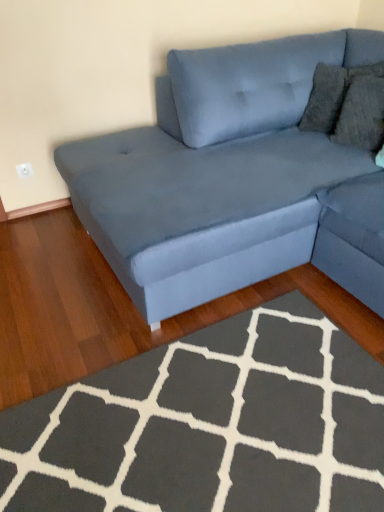
Where is `velvet blue couch at upper right`? The width and height of the screenshot is (384, 512). velvet blue couch at upper right is located at coordinates (231, 179).

What do you see at coordinates (231, 179) in the screenshot? I see `velvet blue couch at upper right` at bounding box center [231, 179].

This screenshot has height=512, width=384. What do you see at coordinates (210, 425) in the screenshot?
I see `dark gray plush rug at lower center` at bounding box center [210, 425].

Measure the distance between dark gray plush rug at lower center and camera.

A distance of 1.14 meters exists between dark gray plush rug at lower center and camera.

At what (x,y) coordinates should I click in order to perform the action: click on dark gray plush rug at lower center. Please return your answer as a coordinate pair (x, y). Image resolution: width=384 pixels, height=512 pixels. Looking at the image, I should click on (210, 425).

Locate an element on the screen. This screenshot has width=384, height=512. velvet blue couch at upper right is located at coordinates (231, 179).

Which is more to the left, velvet blue couch at upper right or dark gray plush rug at lower center?

dark gray plush rug at lower center.

Is velvet blue couch at upper right behind dark gray plush rug at lower center?

Yes, it is behind dark gray plush rug at lower center.

Does point (83, 197) appear closer or farther from the camera than point (103, 407)?

Point (83, 197) appears to be farther away from the viewer than point (103, 407).

From the image's perspective, which is below, velvet blue couch at upper right or dark gray plush rug at lower center?

dark gray plush rug at lower center, from the image's perspective.

From a real-world perspective, who is located higher, velvet blue couch at upper right or dark gray plush rug at lower center?

velvet blue couch at upper right, from a real-world perspective.

Looking at their sizes, would you say velvet blue couch at upper right is wider or thinner than dark gray plush rug at lower center?

Considering their sizes, velvet blue couch at upper right looks broader than dark gray plush rug at lower center.

Between velvet blue couch at upper right and dark gray plush rug at lower center, which one has less height?

Standing shorter between the two is dark gray plush rug at lower center.

Between velvet blue couch at upper right and dark gray plush rug at lower center, which one has smaller size?

Smaller between the two is dark gray plush rug at lower center.

Looking at this image, is velvet blue couch at upper right not within dark gray plush rug at lower center?

Yes, velvet blue couch at upper right is not within dark gray plush rug at lower center.

Is velvet blue couch at upper right in contact with dark gray plush rug at lower center?

No.

Is velvet blue couch at upper right turned away from dark gray plush rug at lower center?

velvet blue couch at upper right is not turned away from dark gray plush rug at lower center.

This screenshot has width=384, height=512. I want to click on doormat located on the left of velvet blue couch at upper right, so click(x=210, y=425).

Is dark gray plush rug at lower center to the right of velvet blue couch at upper right from the viewer's perspective?

No.

Which object is further away from the camera, dark gray plush rug at lower center or velvet blue couch at upper right?

velvet blue couch at upper right is more distant.

Does point (249, 452) come closer to viewer compared to point (147, 202)?

Yes, point (249, 452) is in front of point (147, 202).

From the image's perspective, which one is positioned higher, dark gray plush rug at lower center or velvet blue couch at upper right?

velvet blue couch at upper right appears higher in the image.

From a real-world perspective, is dark gray plush rug at lower center physically below velvet blue couch at upper right?

Indeed, from a real-world perspective, dark gray plush rug at lower center is positioned beneath velvet blue couch at upper right.

Is dark gray plush rug at lower center thinner than velvet blue couch at upper right?

Yes, dark gray plush rug at lower center is thinner than velvet blue couch at upper right.

Considering the relative sizes of dark gray plush rug at lower center and velvet blue couch at upper right in the image provided, is dark gray plush rug at lower center shorter than velvet blue couch at upper right?

Indeed, dark gray plush rug at lower center has a lesser height compared to velvet blue couch at upper right.

Can you confirm if dark gray plush rug at lower center is bigger than velvet blue couch at upper right?

Incorrect, dark gray plush rug at lower center is not larger than velvet blue couch at upper right.

Is dark gray plush rug at lower center inside or outside of velvet blue couch at upper right?

dark gray plush rug at lower center exists outside the volume of velvet blue couch at upper right.

Would you say dark gray plush rug at lower center is a long distance from velvet blue couch at upper right?

No, dark gray plush rug at lower center is in close proximity to velvet blue couch at upper right.

Is dark gray plush rug at lower center looking in the opposite direction of velvet blue couch at upper right?

No, dark gray plush rug at lower center is not facing away from velvet blue couch at upper right.

How different are the orientations of dark gray plush rug at lower center and velvet blue couch at upper right in degrees?

91.9 degrees separate the facing orientations of dark gray plush rug at lower center and velvet blue couch at upper right.

In the image, there is a dark gray plush rug at lower center. At what (x,y) coordinates should I click in order to perform the action: click on studio couch above it (from the image's perspective). Please return your answer as a coordinate pair (x, y). This screenshot has height=512, width=384. Looking at the image, I should click on (231, 179).

Where is `doormat below the velvet blue couch at upper right (from a real-world perspective)`? doormat below the velvet blue couch at upper right (from a real-world perspective) is located at coordinates (210, 425).

Identify the location of studio couch located above the dark gray plush rug at lower center (from a real-world perspective). (231, 179).